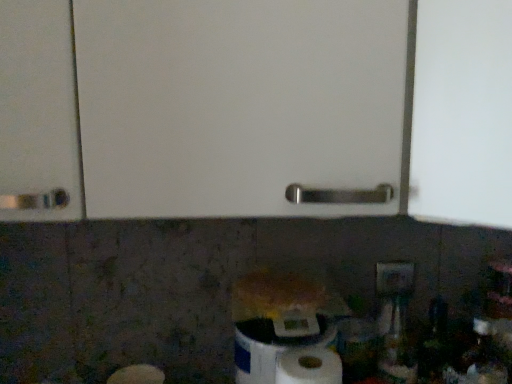
Question: Is white matte paper towel at lower center situated inside white matte toilet paper at lower center or outside?

Choices:
 (A) inside
 (B) outside

Answer: (B)

Question: Is white matte paper towel at lower center taller or shorter than white matte toilet paper at lower center?

Choices:
 (A) tall
 (B) short

Answer: (A)

Question: Estimate the real-world distances between objects in this image. Which object is closer to the white matte paper towel at lower center?

Choices:
 (A) white plastic electric outlet at lower right
 (B) white matte toilet paper at lower center

Answer: (B)

Question: Which of these objects is positioned closest to the white plastic electric outlet at lower right?

Choices:
 (A) white matte paper towel at lower center
 (B) white matte toilet paper at lower center

Answer: (B)